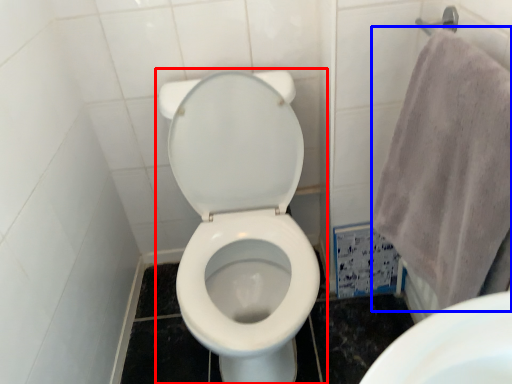
Question: Which object appears closest to the camera in this image, toilet (highlighted by a red box) or bath towel (highlighted by a blue box)?

Choices:
 (A) toilet
 (B) bath towel

Answer: (B)